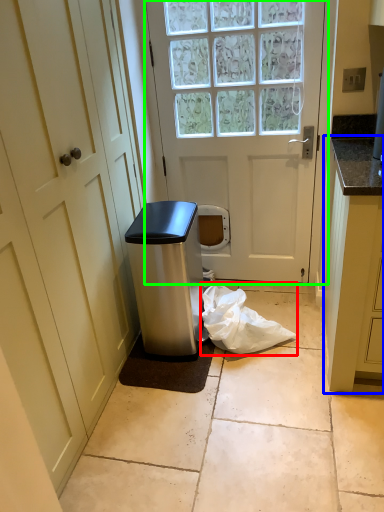
Question: Considering the real-world distances, which object is closest to plastic bag (highlighted by a red box)? cabinetry (highlighted by a blue box) or door (highlighted by a green box).

Choices:
 (A) cabinetry
 (B) door

Answer: (A)